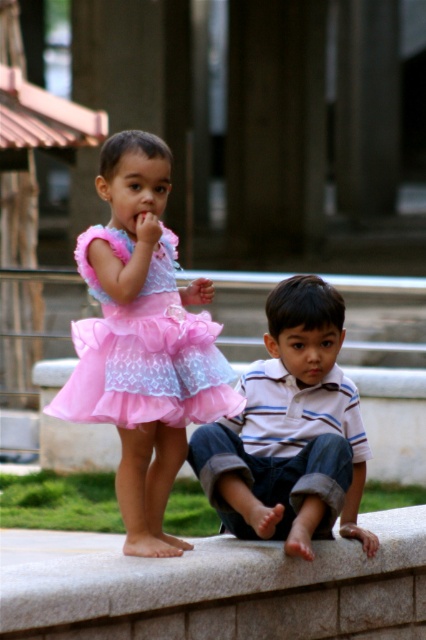
The height and width of the screenshot is (640, 426). What are the coordinates of `pink tulle dress at upper left` in the screenshot? It's located at (143, 340).

Is pink tulle dress at upper left below granite ledge at lower center?

No, pink tulle dress at upper left is not below granite ledge at lower center.

Which is behind, point (229, 369) or point (157, 580)?

Positioned behind is point (229, 369).

Identify the location of pink tulle dress at upper left. Image resolution: width=426 pixels, height=640 pixels. (143, 340).

Based on the photo, between granite ledge at lower center and pink tulle dress at left, which one has more height?

Standing taller between the two is pink tulle dress at left.

Between granite ledge at lower center and pink tulle dress at left, which one appears on the left side from the viewer's perspective?

pink tulle dress at left is more to the left.

Who is more distant from viewer, (270, 627) or (146, 397)?

The point (270, 627) is more distant.

You are a GUI agent. You are given a task and a screenshot of the screen. Output one action in this format:
    pyautogui.click(x=<x>, y=<y>)
    Task: Click on the granite ledge at lower center
    
    Given the screenshot: What is the action you would take?
    pyautogui.click(x=229, y=589)

Is granite ledge at lower center to the left of striped cotton shirt at center from the viewer's perspective?

Indeed, granite ledge at lower center is positioned on the left side of striped cotton shirt at center.

Which is more to the right, granite ledge at lower center or striped cotton shirt at center?

striped cotton shirt at center is more to the right.

Between point (184, 582) and point (253, 502), which one is positioned in front?

Positioned in front is point (184, 582).

This screenshot has height=640, width=426. Identify the location of granite ledge at lower center. (229, 589).